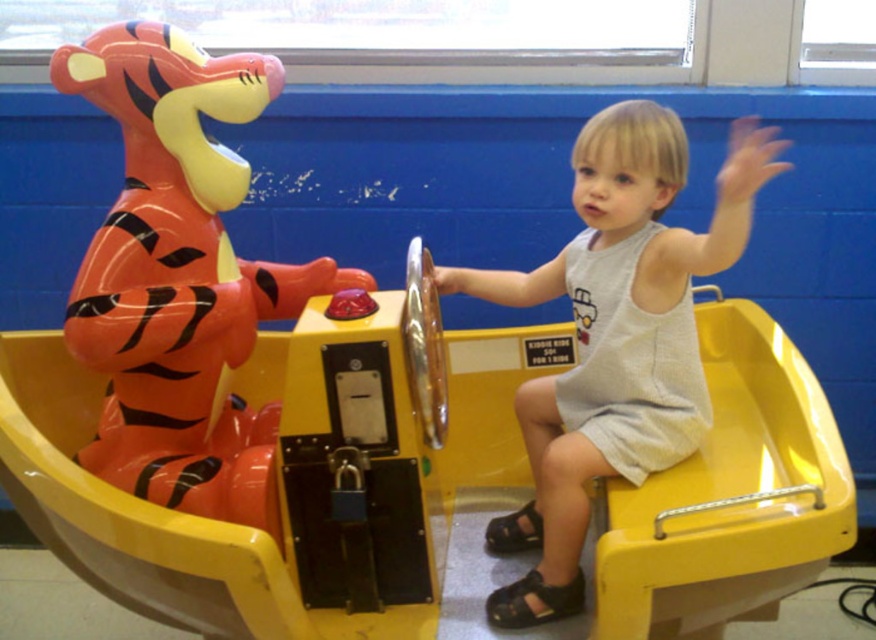
Question: Is rubberized orange tiger at left below white cotton dress at center?

Choices:
 (A) no
 (B) yes

Answer: (A)

Question: Is rubberized orange tiger at left above white cotton dress at center?

Choices:
 (A) no
 (B) yes

Answer: (B)

Question: Is rubberized orange tiger at left thinner than white cotton dress at center?

Choices:
 (A) no
 (B) yes

Answer: (A)

Question: Which object appears farthest from the camera in this image?

Choices:
 (A) rubberized orange tiger at left
 (B) white cotton dress at center

Answer: (A)